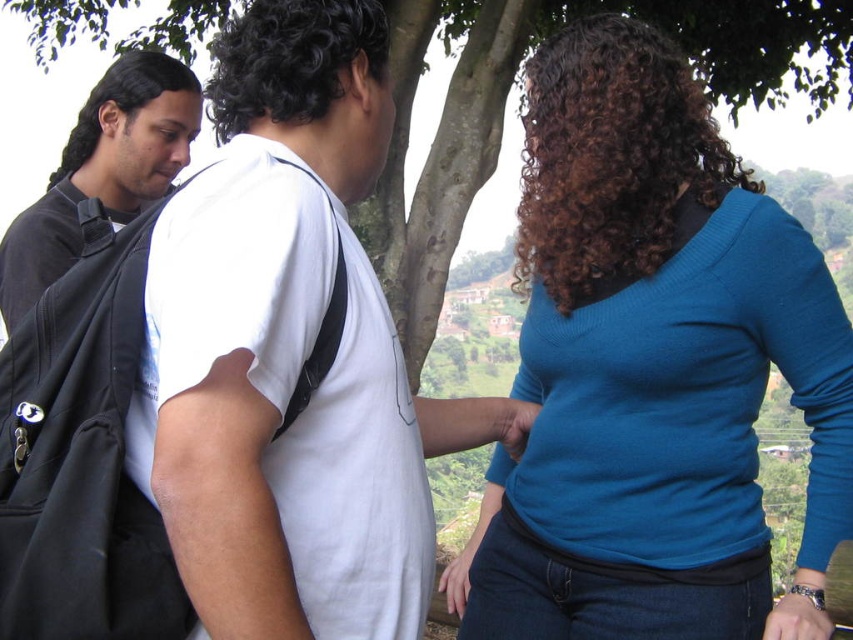
Between blue knit sweater at upper right and black matte backpack at left, which one has less height?

black matte backpack at left

Between point (612, 515) and point (67, 173), which one is positioned behind?

Point (67, 173)

Locate an element on the screen. The height and width of the screenshot is (640, 853). blue knit sweater at upper right is located at coordinates (653, 369).

Looking at this image, between white matte t-shirt at center and black matte backpack at left, which one is positioned higher?

black matte backpack at left

In the scene shown: Does white matte t-shirt at center have a lesser height compared to black matte backpack at left?

No, white matte t-shirt at center is not shorter than black matte backpack at left.

Measure the distance between point (x=297, y=198) and camera.

Point (x=297, y=198) is 54.23 meters away from camera.

At what (x,y) coordinates should I click in order to perform the action: click on white matte t-shirt at center. Please return your answer as a coordinate pair (x, y). The width and height of the screenshot is (853, 640). Looking at the image, I should click on (292, 433).

Does blue knit sweater at upper right appear on the left side of white matte t-shirt at center?

In fact, blue knit sweater at upper right is to the right of white matte t-shirt at center.

Can you confirm if blue knit sweater at upper right is positioned above white matte t-shirt at center?

Yes.

This screenshot has height=640, width=853. What do you see at coordinates (653, 369) in the screenshot?
I see `blue knit sweater at upper right` at bounding box center [653, 369].

I want to click on blue knit sweater at upper right, so click(x=653, y=369).